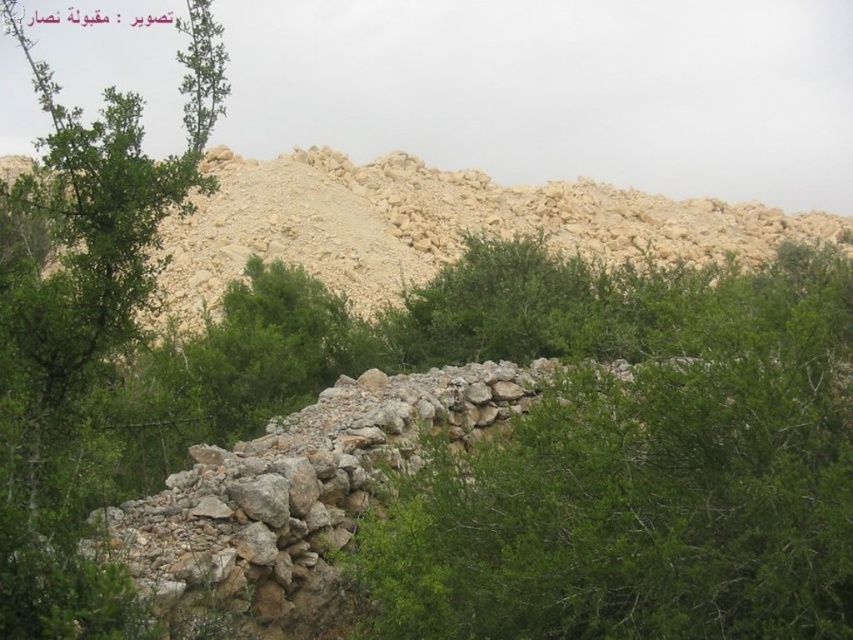
Which is more to the left, green leafy shrub at center or green leafy tree at center?

Positioned to the left is green leafy tree at center.

Is green leafy shrub at center thinner than green leafy tree at center?

Yes.

Find the location of a particular element. The width and height of the screenshot is (853, 640). green leafy shrub at center is located at coordinates (635, 460).

Where is `green leafy shrub at center`? The height and width of the screenshot is (640, 853). green leafy shrub at center is located at coordinates (635, 460).

Looking at this image, can you confirm if green leafy tree at center is taller than beige stone hillside at upper center?

Yes.

Between point (70, 113) and point (569, 228), which one is positioned behind?

The point (569, 228) is behind.

Is point (196, 84) closer to viewer compared to point (10, 157)?

Yes.

Find the location of a particular element. This screenshot has height=640, width=853. green leafy tree at center is located at coordinates (80, 323).

Who is positioned more to the left, green leafy shrub at center or beige stone hillside at upper center?

From the viewer's perspective, green leafy shrub at center appears more on the left side.

Can you confirm if green leafy shrub at center is positioned below beige stone hillside at upper center?

Indeed, green leafy shrub at center is positioned under beige stone hillside at upper center.

Is point (721, 368) behind point (602, 204)?

That is False.

Locate an element on the screen. green leafy shrub at center is located at coordinates (635, 460).